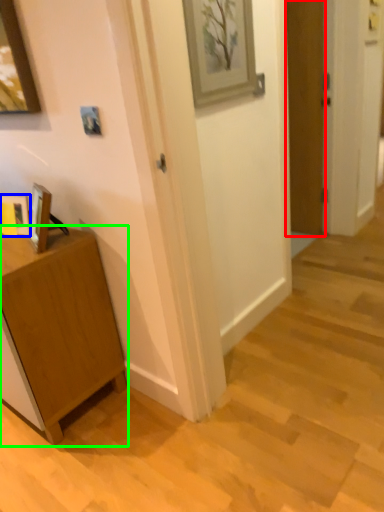
Question: Which object is positioned farthest from door (highlighted by a red box)? Select from picture frame (highlighted by a blue box) and cabinetry (highlighted by a green box).

Choices:
 (A) picture frame
 (B) cabinetry

Answer: (A)